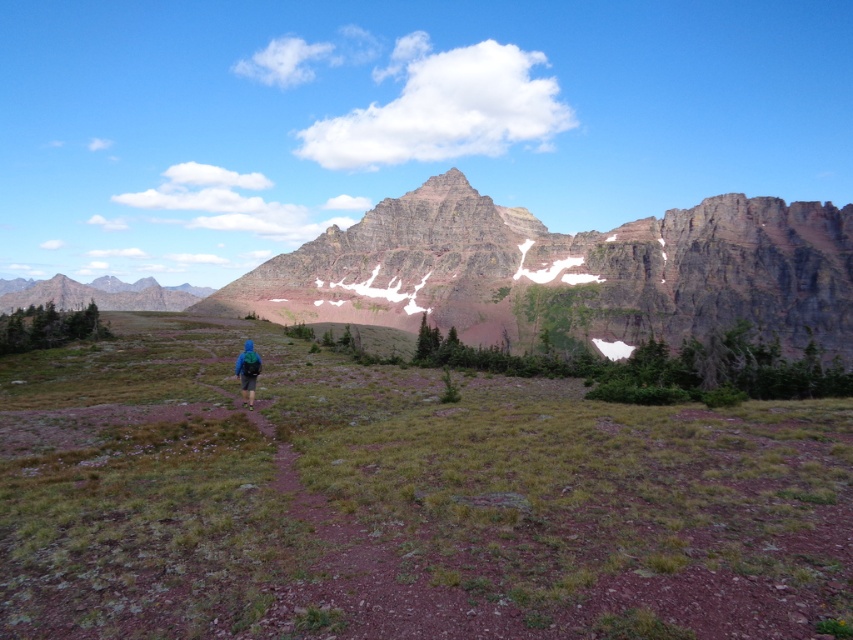
You are a hiker planning to take a photo of the rugged granite mountain at center and the blue fabric backpack at center. Since you want both objects to appear clearly in the photo, which one should you focus on first to ensure proper focus?

The rugged granite mountain at center has a larger size compared to the blue fabric backpack at center, so you should focus on the rugged granite mountain at center first to ensure proper focus.